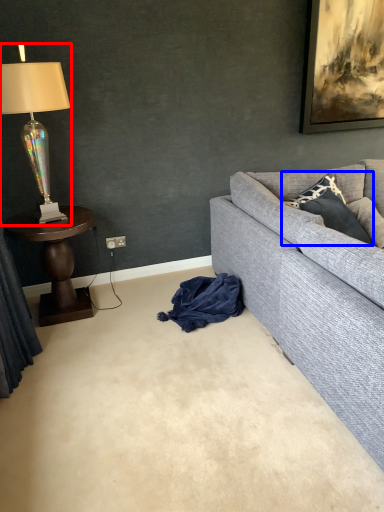
Question: Which of the following is the closest to the observer, lamp (highlighted by a red box) or pillow (highlighted by a blue box)?

Choices:
 (A) lamp
 (B) pillow

Answer: (A)